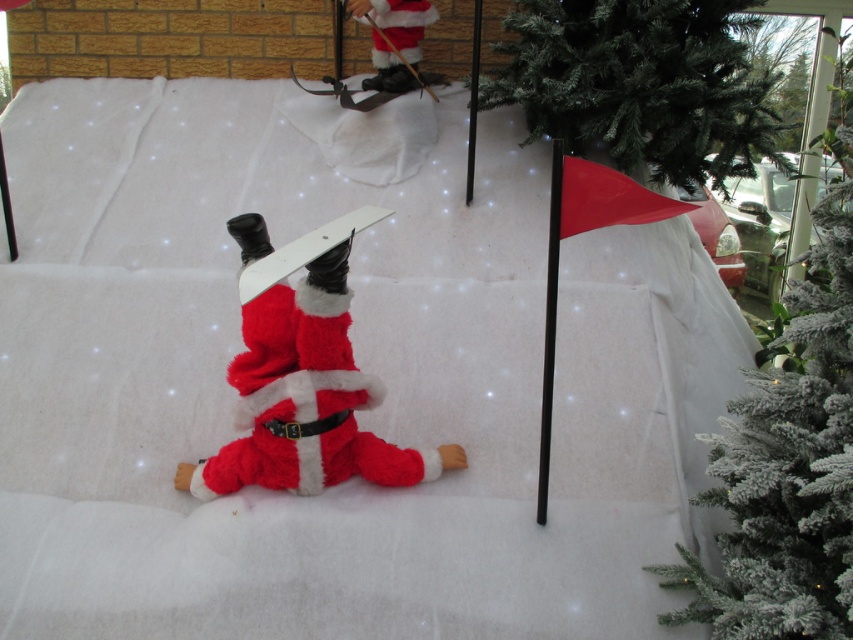
Can you confirm if white plastic ski at center is thinner than black plastic flagpole at center?

No.

Does white plastic ski at center appear on the left side of black plastic flagpole at center?

Correct, you'll find white plastic ski at center to the left of black plastic flagpole at center.

Is point (276, 253) farther from camera compared to point (471, 173)?

No.

You are a GUI agent. You are given a task and a screenshot of the screen. Output one action in this format:
    pyautogui.click(x=<x>, y=<y>)
    Task: Click on the white plastic ski at center
    
    Given the screenshot: What is the action you would take?
    pyautogui.click(x=305, y=250)

Who is lower down, fuzzy red santa at center or fuzzy santa at upper center?

Positioned lower is fuzzy red santa at center.

Which of these two, fuzzy red santa at center or fuzzy santa at upper center, stands shorter?

With less height is fuzzy santa at upper center.

Which is in front, point (323, 420) or point (401, 52)?

Point (323, 420)

Locate an element on the screen. The image size is (853, 640). fuzzy red santa at center is located at coordinates (303, 376).

Between point (553, 275) and point (289, 262), which one is positioned in front?

Positioned in front is point (289, 262).

This screenshot has width=853, height=640. Find the location of `black matte pole at right`. black matte pole at right is located at coordinates (549, 328).

Is point (537, 522) more distant than point (358, 225)?

Yes, point (537, 522) is behind point (358, 225).

At what (x,y) coordinates should I click in order to perform the action: click on black matte pole at right. Please return your answer as a coordinate pair (x, y). Looking at the image, I should click on (549, 328).